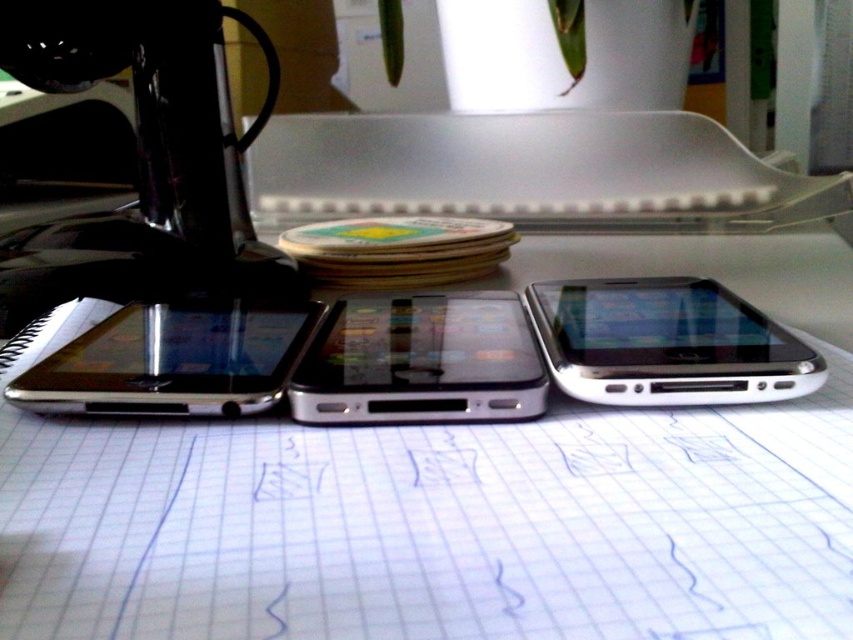
Question: Is the position of white paper at center more distant than that of white glossy smartphone at center?

Choices:
 (A) yes
 (B) no

Answer: (B)

Question: Which of these objects is positioned closest to the white glossy smartphone at center?

Choices:
 (A) satin black smartphone at left
 (B) satin black smartphone at center

Answer: (B)

Question: Is white glossy smartphone at center in front of satin black smartphone at center?

Choices:
 (A) yes
 (B) no

Answer: (B)

Question: Based on their relative distances, which object is farther from the satin black smartphone at left?

Choices:
 (A) white paper at center
 (B) satin black smartphone at center

Answer: (A)

Question: Which of these objects is positioned farthest from the satin black smartphone at center?

Choices:
 (A) satin black smartphone at left
 (B) white glossy smartphone at center

Answer: (B)

Question: Does white paper at center appear under satin black smartphone at center?

Choices:
 (A) yes
 (B) no

Answer: (B)